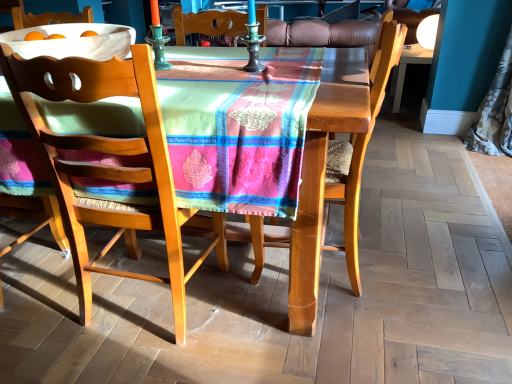
What is the approximate height of silky floral curtain at right?

silky floral curtain at right is 37.71 inches in height.

What do you see at coordinates (359, 148) in the screenshot? I see `wooden chair at center, arranged as the second chair when viewed from the left` at bounding box center [359, 148].

Where is `silky floral curtain at right`? silky floral curtain at right is located at coordinates (495, 112).

Is point (387, 15) positioned before point (145, 128)?

No.

Which object is closer to the camera, wooden chair at center, the first chair viewed from the right, or wooden chair with woven seat at center, arranged as the first chair when viewed from the left?

Positioned in front is wooden chair with woven seat at center, arranged as the first chair when viewed from the left.

From the image's perspective, would you say wooden chair at center, arranged as the second chair when viewed from the left, is positioned over wooden chair with woven seat at center, arranged as the first chair when viewed from the left?

Indeed, from the image's perspective, wooden chair at center, arranged as the second chair when viewed from the left, is shown above wooden chair with woven seat at center, arranged as the first chair when viewed from the left.

From the image's perspective, is wooden chair at center, the first chair viewed from the right, located above or below matte black desk at upper right?

From the image's perspective, wooden chair at center, the first chair viewed from the right, appears below matte black desk at upper right.

From a real-world perspective, is wooden chair at center, the first chair viewed from the right, physically above matte black desk at upper right?

Yes, from a real-world perspective, wooden chair at center, the first chair viewed from the right, is on top of matte black desk at upper right.

Which object is further away from the camera taking this photo, wooden chair at center, the first chair viewed from the right, or matte black desk at upper right?

Positioned behind is matte black desk at upper right.

Consider the image. Which is farther from the camera, (370, 78) or (400, 66)?

The point (400, 66) is farther from the camera.

What's the angular difference between silky floral curtain at right and wooden chair with woven seat at center, the second chair positioned from the right,'s facing directions?

They differ by 86.2 degrees in their facing directions.

Is silky floral curtain at right with wooden chair with woven seat at center, the second chair positioned from the right?

No, silky floral curtain at right is not beside wooden chair with woven seat at center, the second chair positioned from the right.

Is silky floral curtain at right turned away from wooden chair with woven seat at center, the second chair positioned from the right?

That's not correct — silky floral curtain at right is not looking away from wooden chair with woven seat at center, the second chair positioned from the right.

From the image's perspective, is silky floral curtain at right located above wooden chair with woven seat at center, arranged as the first chair when viewed from the left?

Yes, from the image's perspective, silky floral curtain at right is above wooden chair with woven seat at center, arranged as the first chair when viewed from the left.

Looking at this image, is matte black desk at upper right not near wooden chair at center, arranged as the second chair when viewed from the left?

That's right, there is a large distance between matte black desk at upper right and wooden chair at center, arranged as the second chair when viewed from the left.

Is point (397, 70) closer or farther from the camera than point (251, 279)?

Point (397, 70) appears to be farther away from the viewer than point (251, 279).

Does matte black desk at upper right lie behind wooden chair at center, arranged as the second chair when viewed from the left?

That is True.

Can we say matte black desk at upper right lies outside wooden chair at center, arranged as the second chair when viewed from the left?

Indeed, matte black desk at upper right is completely outside wooden chair at center, arranged as the second chair when viewed from the left.

Considering the positions of objects matte black desk at upper right and silky floral curtain at right in the image provided, who is in front, matte black desk at upper right or silky floral curtain at right?

silky floral curtain at right is closer to the camera.

Which is behind, point (419, 52) or point (485, 121)?

The point (419, 52) is farther from the camera.

Which of these two, matte black desk at upper right or silky floral curtain at right, is bigger?

silky floral curtain at right.

Is matte black desk at upper right to the left of silky floral curtain at right from the viewer's perspective?

Indeed, matte black desk at upper right is positioned on the left side of silky floral curtain at right.

Is point (353, 266) closer to camera compared to point (492, 104)?

Yes.

Can you confirm if wooden chair at center, the first chair viewed from the right, is bigger than silky floral curtain at right?

Yes.

Between wooden chair at center, the first chair viewed from the right, and silky floral curtain at right, which one is positioned behind?

silky floral curtain at right is behind.

Considering the relative sizes of wooden chair at center, the first chair viewed from the right, and silky floral curtain at right in the image provided, is wooden chair at center, the first chair viewed from the right, thinner than silky floral curtain at right?

No.

Considering the relative sizes of silky floral curtain at right and wooden chair at center, arranged as the second chair when viewed from the left, in the image provided, is silky floral curtain at right taller than wooden chair at center, arranged as the second chair when viewed from the left,?

Yes, silky floral curtain at right is taller than wooden chair at center, arranged as the second chair when viewed from the left.

Does point (501, 62) come farther from viewer compared to point (256, 274)?

Yes, it is behind point (256, 274).

Is wooden chair at center, the first chair viewed from the right, a part of silky floral curtain at right?

No, wooden chair at center, the first chair viewed from the right, is not surrounded by silky floral curtain at right.

Consider the image. Does silky floral curtain at right appear on the right side of wooden chair at center, arranged as the second chair when viewed from the left?

Indeed, silky floral curtain at right is positioned on the right side of wooden chair at center, arranged as the second chair when viewed from the left.

Locate an element on the screen. This screenshot has width=512, height=384. chair beneath the wooden chair at center, arranged as the second chair when viewed from the left (from a real-world perspective) is located at coordinates (110, 165).

Starting from the matte black desk at upper right, which chair is the 1st one in front? Please provide its 2D coordinates.

[(359, 148)]

From the image, which object appears to be farther from wooden chair at center, the first chair viewed from the right, silky floral curtain at right or matte black desk at upper right?

matte black desk at upper right lies further to wooden chair at center, the first chair viewed from the right, than the other object.

Estimate the real-world distances between objects in this image. Which object is closer to silky floral curtain at right, wooden chair with woven seat at center, the second chair positioned from the right, or matte black desk at upper right?

matte black desk at upper right is closer to silky floral curtain at right.

Looking at the image, which one is located closer to wooden chair with woven seat at center, the second chair positioned from the right, wooden chair at center, the first chair viewed from the right, or silky floral curtain at right?

Based on the image, wooden chair at center, the first chair viewed from the right, appears to be nearer to wooden chair with woven seat at center, the second chair positioned from the right.

When comparing their distances from silky floral curtain at right, does wooden chair at center, the first chair viewed from the right, or wooden chair with woven seat at center, the second chair positioned from the right, seem closer?

wooden chair at center, the first chair viewed from the right, is closer to silky floral curtain at right.

When comparing their distances from silky floral curtain at right, does wooden chair at center, the first chair viewed from the right, or matte black desk at upper right seem closer?

Among the two, matte black desk at upper right is located nearer to silky floral curtain at right.

Looking at the image, which one is located further to matte black desk at upper right, silky floral curtain at right or wooden chair with woven seat at center, arranged as the first chair when viewed from the left?

Based on the image, wooden chair with woven seat at center, arranged as the first chair when viewed from the left, appears to be further to matte black desk at upper right.

Based on their spatial positions, is silky floral curtain at right or wooden chair with woven seat at center, arranged as the first chair when viewed from the left, further from wooden chair at center, the first chair viewed from the right?

Among the two, silky floral curtain at right is located further to wooden chair at center, the first chair viewed from the right.

From the picture: Estimate the real-world distances between objects in this image. Which object is further from matte black desk at upper right, silky floral curtain at right or wooden chair at center, arranged as the second chair when viewed from the left?

Among the two, wooden chair at center, arranged as the second chair when viewed from the left, is located further to matte black desk at upper right.

Where is `chair between wooden chair with woven seat at center, arranged as the first chair when viewed from the left, and matte black desk at upper right, along the z-axis`? chair between wooden chair with woven seat at center, arranged as the first chair when viewed from the left, and matte black desk at upper right, along the z-axis is located at coordinates (359, 148).

Where is `chair situated between wooden chair with woven seat at center, the second chair positioned from the right, and silky floral curtain at right from left to right`? The height and width of the screenshot is (384, 512). chair situated between wooden chair with woven seat at center, the second chair positioned from the right, and silky floral curtain at right from left to right is located at coordinates (359, 148).

Image resolution: width=512 pixels, height=384 pixels. What are the coordinates of `curtain between wooden chair with woven seat at center, the second chair positioned from the right, and matte black desk at upper right from front to back` in the screenshot? It's located at (495, 112).

The height and width of the screenshot is (384, 512). Find the location of `curtain positioned between wooden chair at center, the first chair viewed from the right, and matte black desk at upper right from near to far`. curtain positioned between wooden chair at center, the first chair viewed from the right, and matte black desk at upper right from near to far is located at coordinates (495, 112).